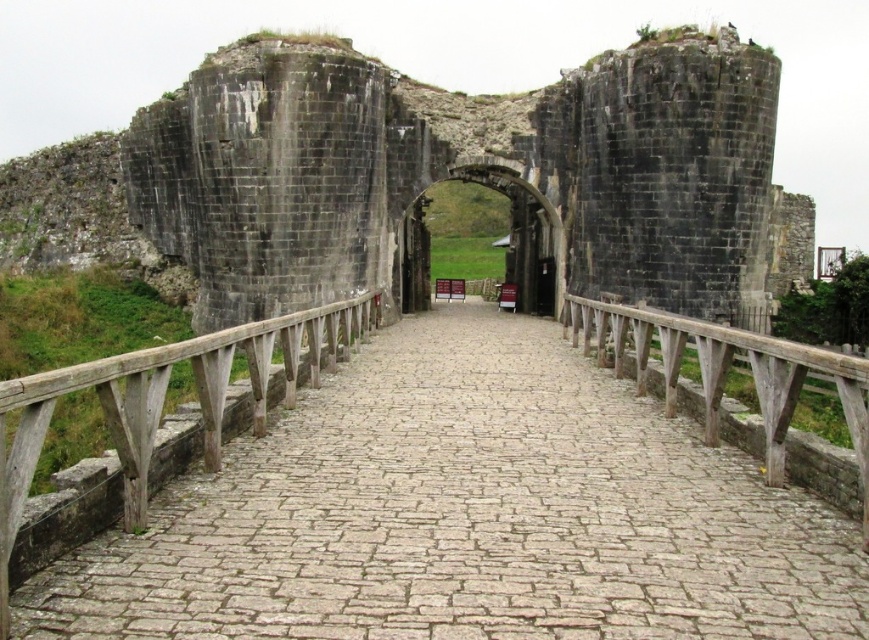
Question: Which point is farther from the camera taking this photo?

Choices:
 (A) (753, 476)
 (B) (284, 342)

Answer: (B)

Question: Does smooth stone path at center appear on the left side of dark gray stone archway at center?

Choices:
 (A) yes
 (B) no

Answer: (B)

Question: Which point is farther to the camera?

Choices:
 (A) weathered wood rail at center
 (B) stone archway at center

Answer: (B)

Question: Which of the following is the closest to the observer?

Choices:
 (A) wooden at left
 (B) weathered wood rail at center
 (C) smooth stone path at center
 (D) stone archway at center

Answer: (A)

Question: In this image, where is dark gray stone archway at center located relative to weathered wood rail at center?

Choices:
 (A) above
 (B) below

Answer: (A)

Question: Is wooden at left closer to the viewer compared to weathered wood rail at center?

Choices:
 (A) yes
 (B) no

Answer: (A)